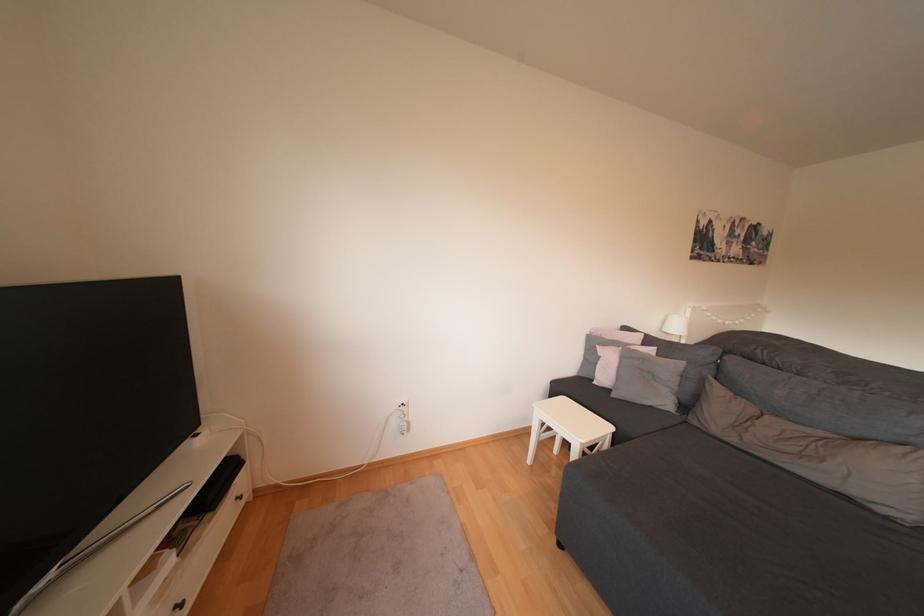
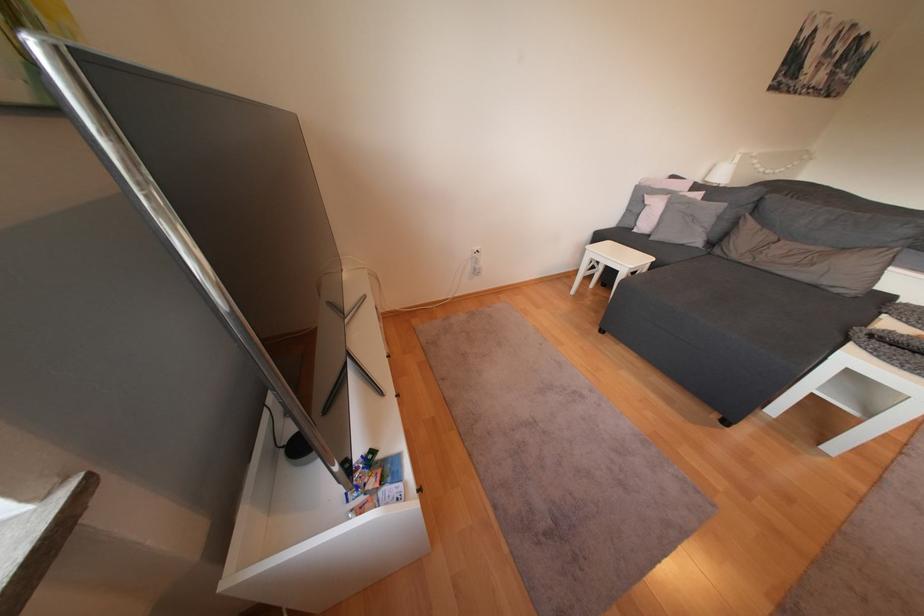
What movement of the cameraman would produce the second image?

The cameraman moved toward left, backward.